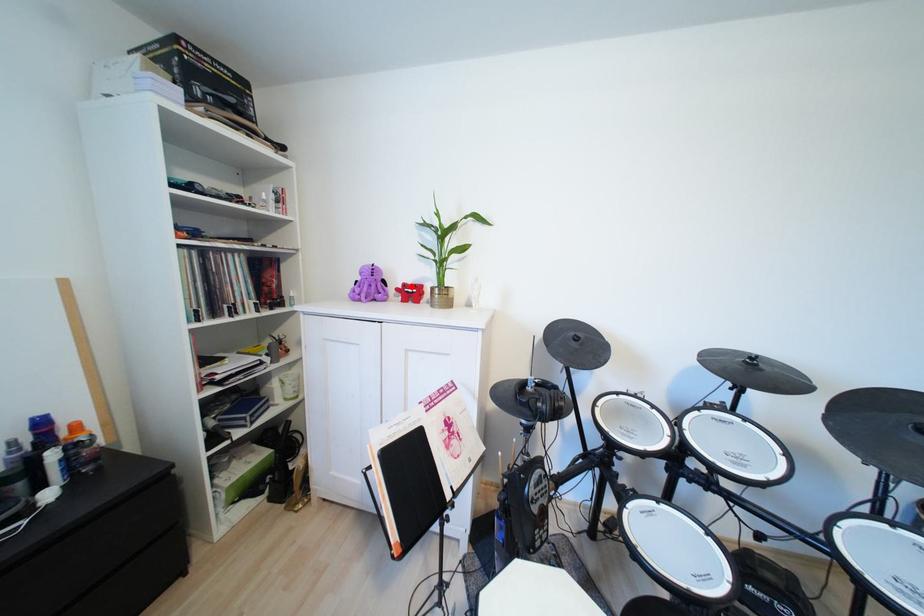
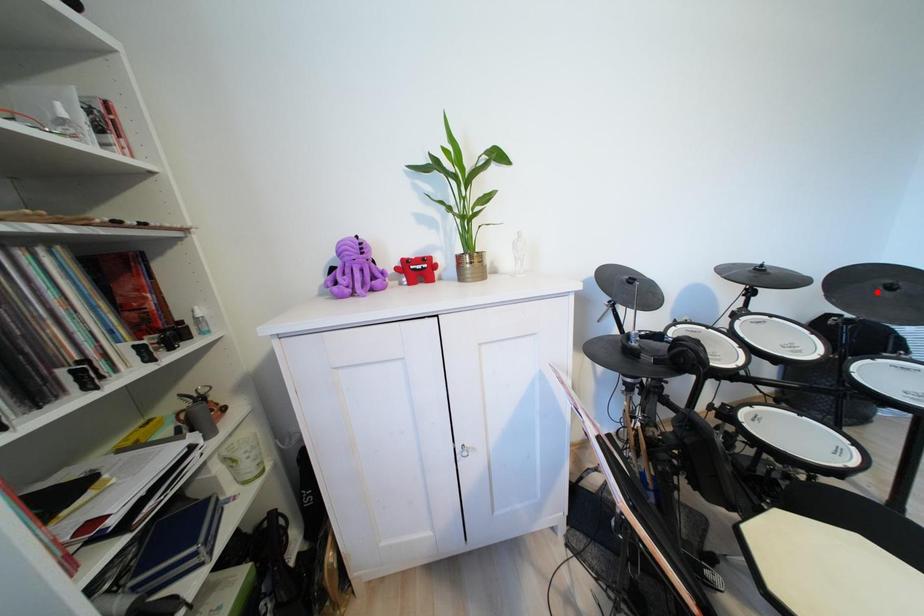
I am providing you with two images of the same scene from different viewpoints. A red point is marked on the first image and another point is marked on the second image. Are the points marked in image1 and image2 representing the same 3D position?

No